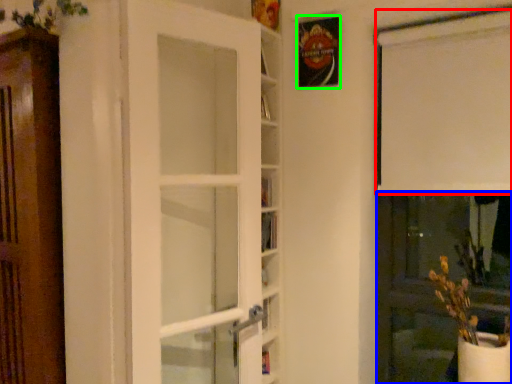
Question: Estimate the real-world distances between objects in this image. Which object is farther from curtain (highlighted by a red box), screen door (highlighted by a blue box) or picture frame (highlighted by a green box)?

Choices:
 (A) screen door
 (B) picture frame

Answer: (A)